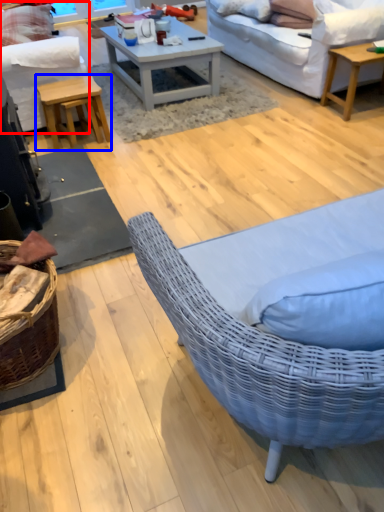
Question: Which object is closer to the camera taking this photo, studio couch (highlighted by a red box) or table (highlighted by a blue box)?

Choices:
 (A) studio couch
 (B) table

Answer: (A)